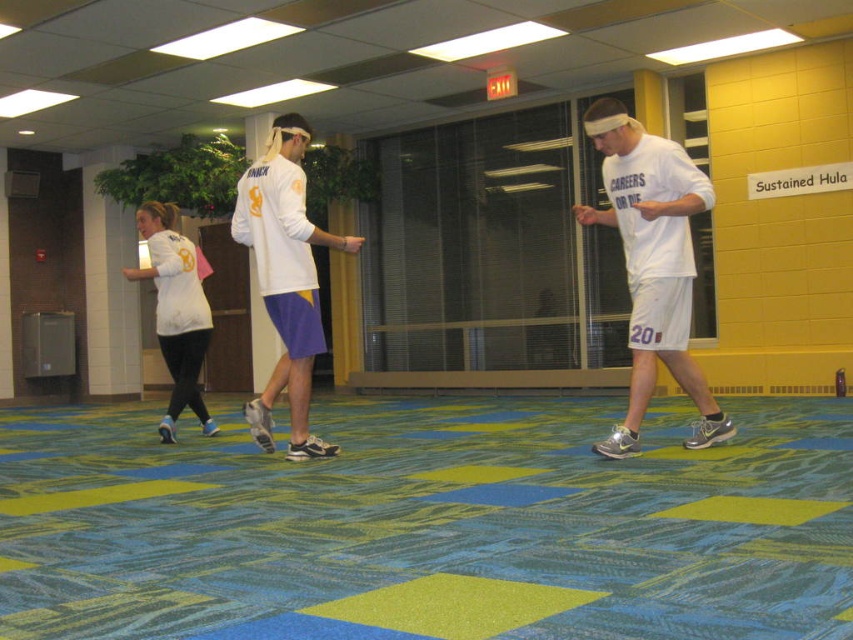
Measure the distance between white matte shorts at center and white matte jersey at center.

white matte shorts at center and white matte jersey at center are 5.73 feet apart.

Does white matte shorts at center lie behind white matte jersey at center?

No, white matte shorts at center is closer to the viewer.

The image size is (853, 640). Identify the location of white matte shorts at center. (653, 262).

Image resolution: width=853 pixels, height=640 pixels. Find the location of `white matte shorts at center`. white matte shorts at center is located at coordinates (653, 262).

Can you confirm if white matte shorts at center is positioned to the left of white matte shirt at left?

Incorrect, white matte shorts at center is not on the left side of white matte shirt at left.

Measure the distance between white matte shorts at center and white matte shirt at left.

They are 3.24 meters apart.

Is point (683, 442) behind point (202, 348)?

No, (683, 442) is in front of (202, 348).

I want to click on white matte shorts at center, so click(x=653, y=262).

Between point (291, 173) and point (194, 355), which one is positioned behind?

The point (194, 355) is more distant.

Where is `white matte jersey at center`? white matte jersey at center is located at coordinates (285, 276).

The width and height of the screenshot is (853, 640). Describe the element at coordinates (285, 276) in the screenshot. I see `white matte jersey at center` at that location.

Find the location of a particular element. This screenshot has width=853, height=640. white matte jersey at center is located at coordinates (285, 276).